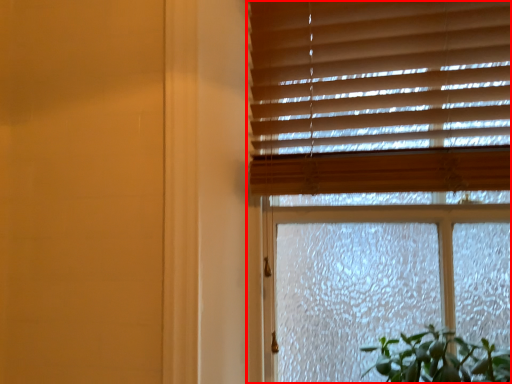
Question: From the image's perspective, what is the correct spatial relationship of window (annotated by the red box) in relation to blind?

Choices:
 (A) above
 (B) below

Answer: (B)